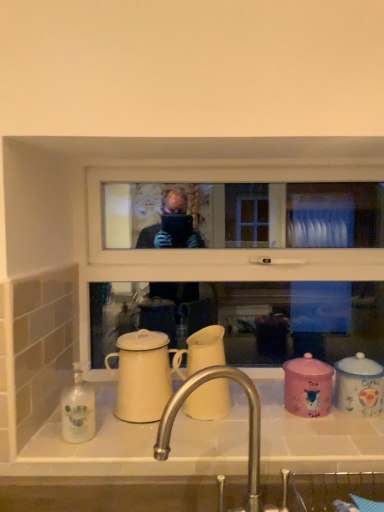
Find the location of a particular element. blank space situated above white glossy sink at lower center (from a real-world perspective) is located at coordinates (225, 420).